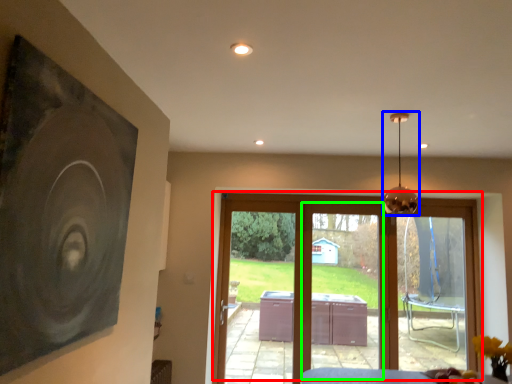
Question: Estimate the real-world distances between objects in this image. Which object is farther from door (highlighted by a red box), lamp (highlighted by a blue box) or screen door (highlighted by a green box)?

Choices:
 (A) lamp
 (B) screen door

Answer: (A)